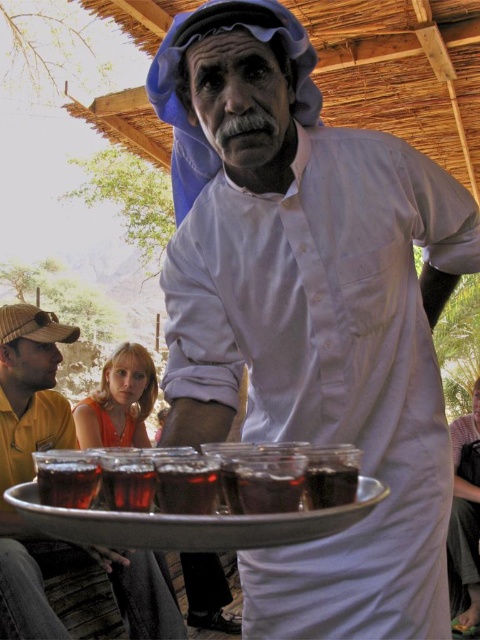
Question: Observing the image, what is the correct spatial positioning of matte white tray at lower center in reference to translucent glass cup at center?

Choices:
 (A) below
 (B) above

Answer: (A)

Question: Among these objects, which one is nearest to the camera?

Choices:
 (A) translucent glass cup at lower center
 (B) white matte shirt at center
 (C) translucent glass cup at center
 (D) dark brown glass at center

Answer: (C)

Question: Does matte white tray at lower center have a greater width compared to translucent glass cup at center?

Choices:
 (A) no
 (B) yes

Answer: (B)

Question: Is translucent glass cup at center wider than translucent glass cup at lower center?

Choices:
 (A) no
 (B) yes

Answer: (B)

Question: Which point is closer to the camera?

Choices:
 (A) (297, 476)
 (B) (347, 291)
 (C) (31, 625)

Answer: (A)

Question: Which point is closer to the camera?

Choices:
 (A) translucent glass cup at center
 (B) matte white tray at lower center
 (C) translucent glass cup at lower left
 (D) translucent glass cup at lower center

Answer: (A)